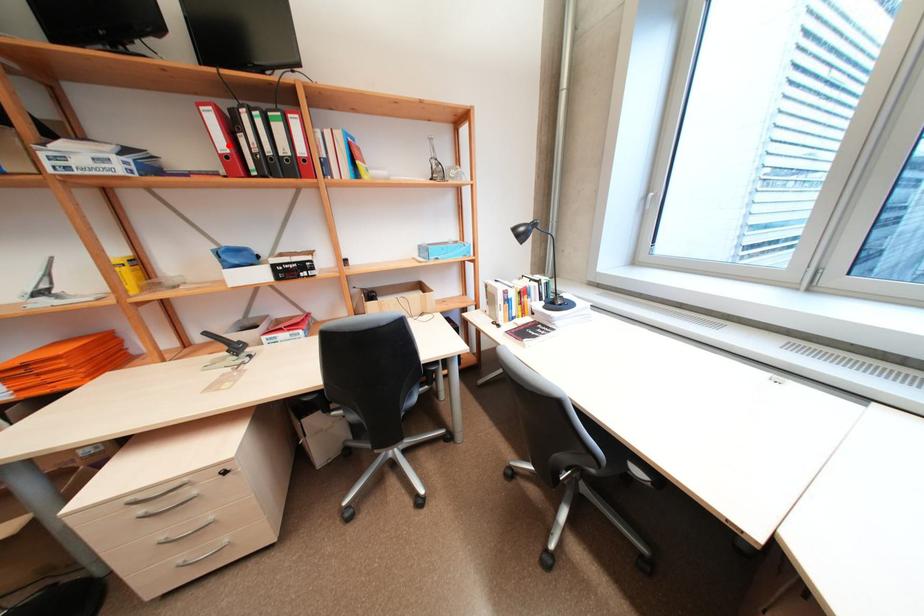
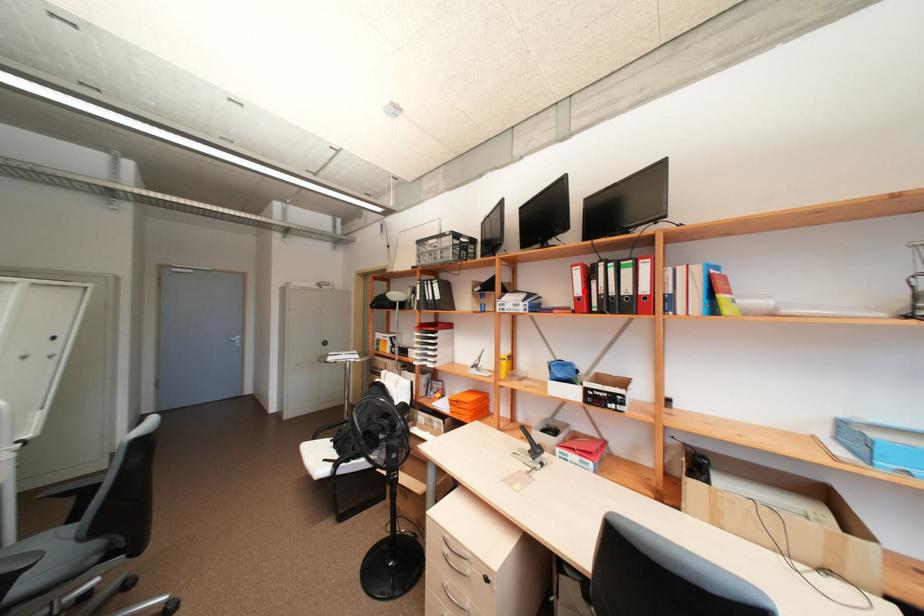
In the scene shown: I am providing you with two images of the same scene from different viewpoints. A red point is marked on the first image and another point is marked on the second image. Is the marked point in image1 the same physical position as the marked point in image2?

Yes